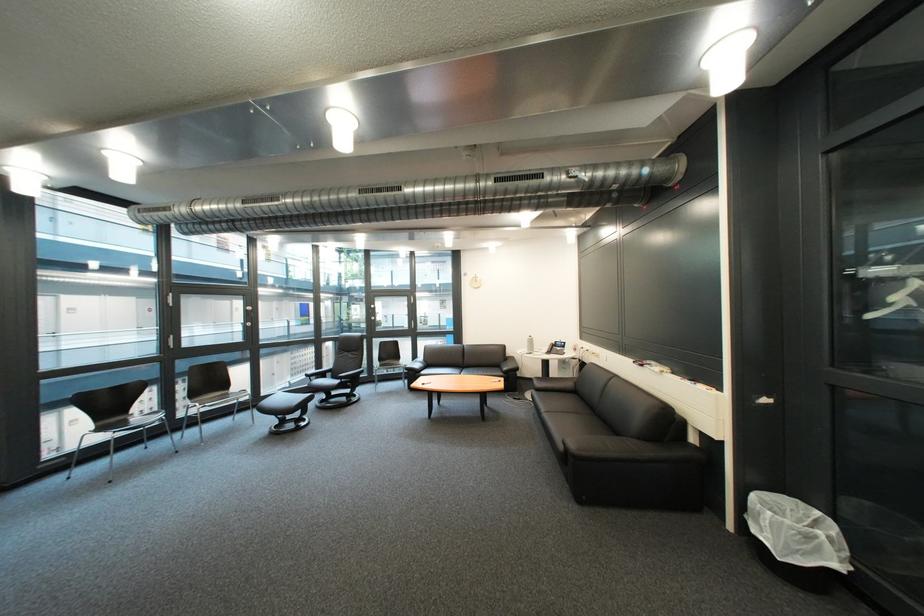
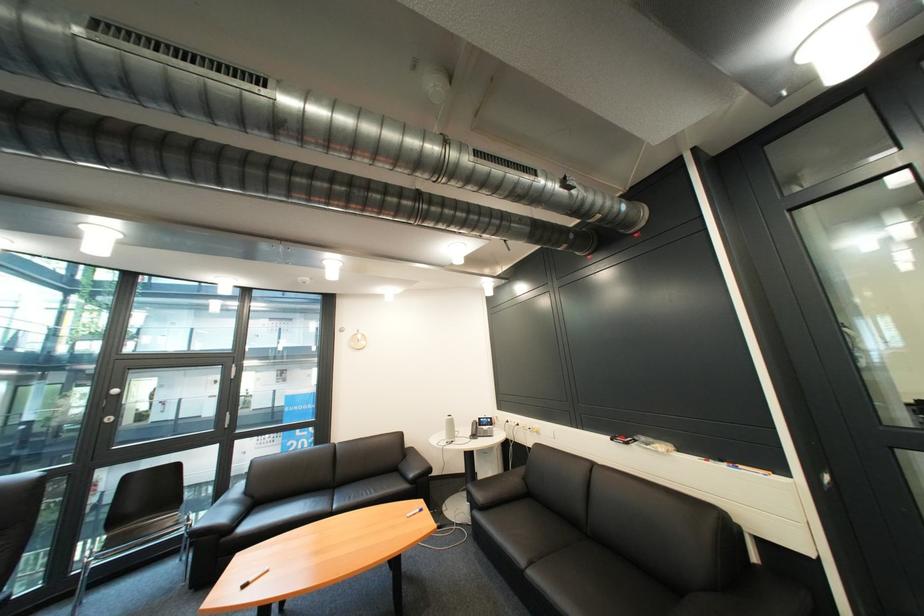
The point at (569,344) is marked in the first image. Where is the corresponding point in the second image?

(492, 419)